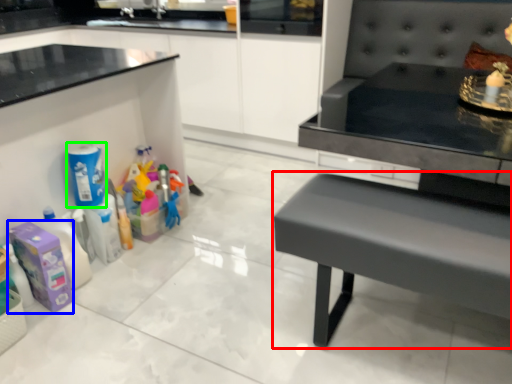
Question: Based on their relative distances, which object is farther from table (highlighted by a red box)? Choose from cleaning product (highlighted by a blue box) and cleaning product (highlighted by a green box).

Choices:
 (A) cleaning product
 (B) cleaning product

Answer: (B)